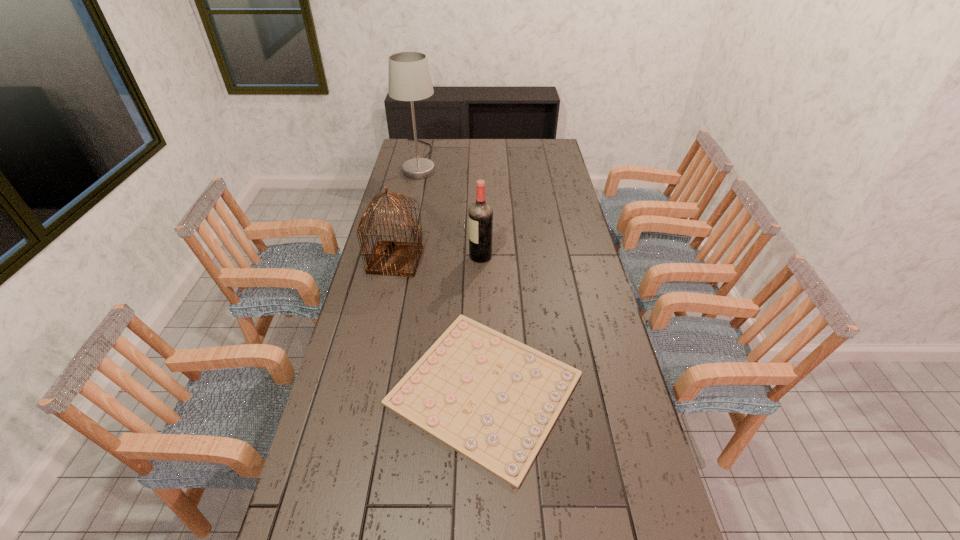
Identify the location of free region located on the front of the birdcage. (382, 322).

The height and width of the screenshot is (540, 960). I want to click on vacant space located on the left of the nearest object, so click(x=361, y=389).

Identify the location of object at the far edge. The width and height of the screenshot is (960, 540). (409, 79).

This screenshot has height=540, width=960. Find the location of `table lamp present at the left edge`. table lamp present at the left edge is located at coordinates (409, 79).

Identify the location of birdcage present at the left edge. Image resolution: width=960 pixels, height=540 pixels. (394, 258).

I want to click on gameboard located in the left edge section of the desktop, so click(x=493, y=399).

Image resolution: width=960 pixels, height=540 pixels. Find the location of `object at the right edge`. object at the right edge is located at coordinates (493, 399).

Where is `object that is at the far left corner`? The height and width of the screenshot is (540, 960). object that is at the far left corner is located at coordinates (409, 79).

In the image, there is a desktop. At what (x,y) coordinates should I click in order to perform the action: click on blank space at the left edge. Please return your answer as a coordinate pair (x, y). The image size is (960, 540). Looking at the image, I should click on (372, 340).

Identify the location of free space at the right edge. (552, 197).